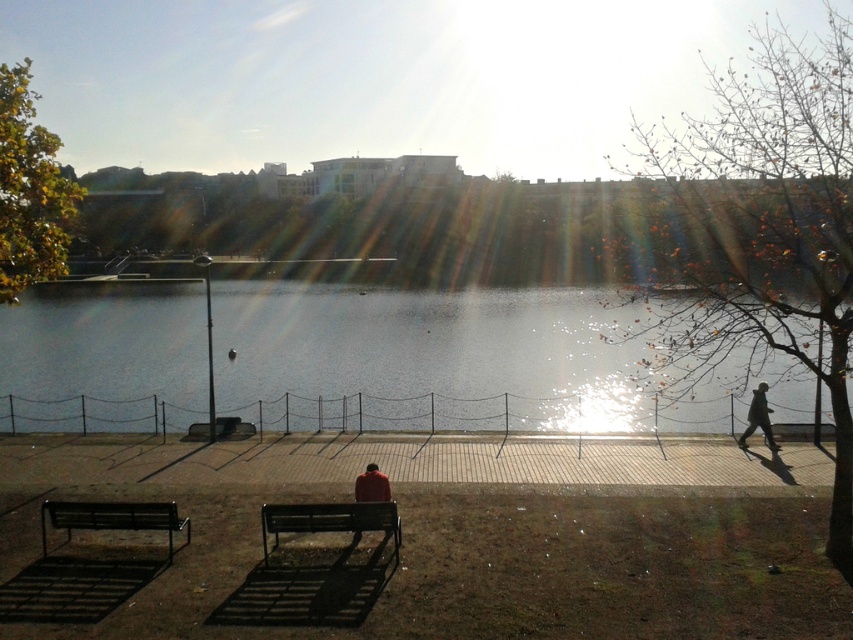
Question: Can you confirm if metallic dark bench at center is positioned to the left of metallic black bench at lower left?

Choices:
 (A) yes
 (B) no

Answer: (B)

Question: Among these points, which one is nearest to the camera?

Choices:
 (A) (225, 428)
 (B) (167, 545)
 (C) (751, 401)
 (D) (312, 508)

Answer: (D)

Question: Which point appears closest to the camera in this image?

Choices:
 (A) (381, 490)
 (B) (194, 422)
 (C) (770, 436)
 (D) (277, 524)

Answer: (D)

Question: Can you confirm if metallic dark gray bench at lower center is bigger than red matte jacket at center?

Choices:
 (A) yes
 (B) no

Answer: (A)

Question: Can you confirm if reflective glass water at center is smaller than metallic black bench at lower left?

Choices:
 (A) yes
 (B) no

Answer: (B)

Question: Which of the following is the farthest from the observer?

Choices:
 (A) (242, 429)
 (B) (757, 412)
 (C) (351, 529)

Answer: (A)